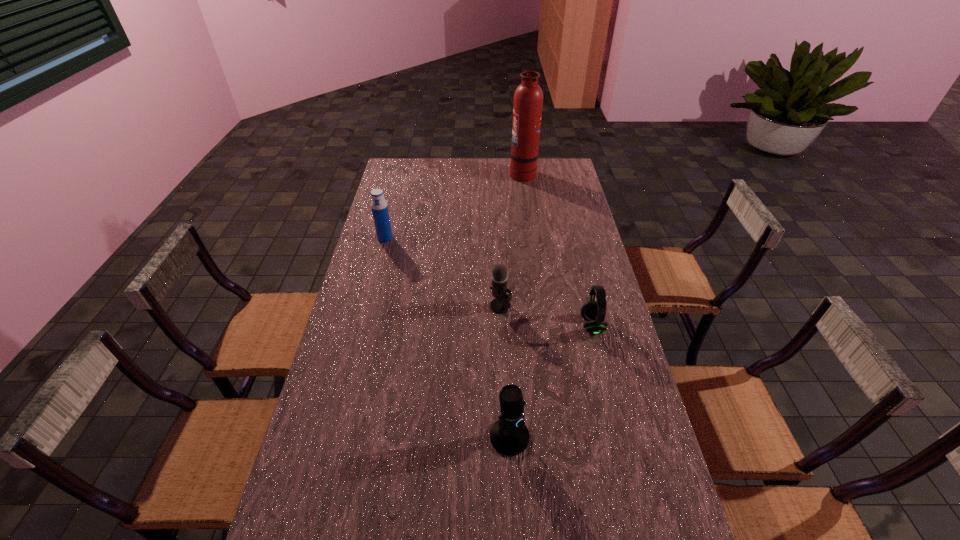
In the image, there is a desktop. In order to click on vacant space at the far edge in this screenshot , I will do `click(429, 170)`.

The image size is (960, 540). In order to click on vacant region at the left edge in this screenshot , I will do `click(354, 442)`.

The width and height of the screenshot is (960, 540). I want to click on free point at the right edge, so click(626, 404).

I want to click on free space at the far right corner of the desktop, so click(x=570, y=176).

Identify the location of free space between the leftmost object and the rightmost object. (489, 282).

You are a GUI agent. You are given a task and a screenshot of the screen. Output one action in this format:
    pyautogui.click(x=<x>, y=<y>)
    Task: Click on the unoccupied position between the rightmost object and the second farthest object
    The width and height of the screenshot is (960, 540).
    Given the screenshot: What is the action you would take?
    pyautogui.click(x=489, y=282)

The image size is (960, 540). I want to click on free spot between the nearer microphone and the fourth object from left to right, so click(x=516, y=305).

The height and width of the screenshot is (540, 960). Find the location of `free point between the nearest object and the second farthest object`. free point between the nearest object and the second farthest object is located at coordinates (447, 338).

Find the location of a particular element. object identified as the closest to the leftmost object is located at coordinates (501, 304).

Find the location of a particular element. the third closest object to the second farthest object is located at coordinates (593, 312).